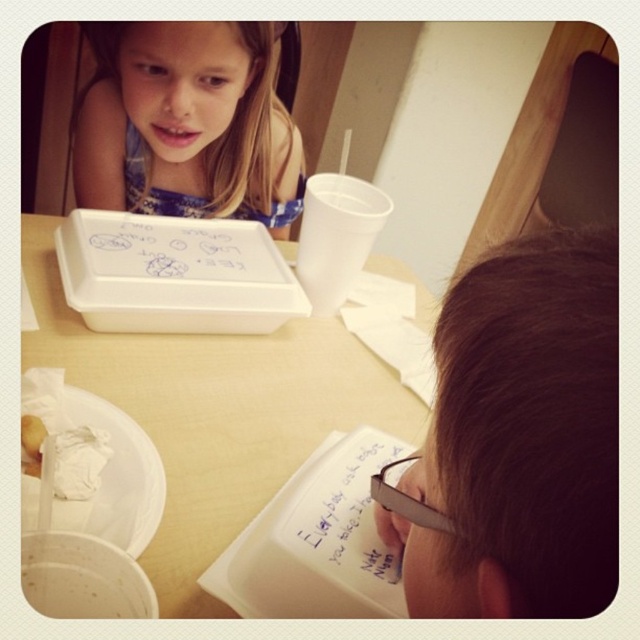
Question: Is white plastic tray at center bigger than white paper at center?

Choices:
 (A) no
 (B) yes

Answer: (B)

Question: Does brown hair at upper right have a larger size compared to white paper at center?

Choices:
 (A) no
 (B) yes

Answer: (B)

Question: Among these points, which one is nearest to the camera?

Choices:
 (A) (385, 547)
 (B) (221, 120)

Answer: (A)

Question: Which point is closer to the camera taking this photo?

Choices:
 (A) (604, 266)
 (B) (29, 349)
 (C) (324, 513)

Answer: (A)

Question: Among these points, which one is nearest to the camera?

Choices:
 (A) (547, 461)
 (B) (336, 460)
 (C) (172, 198)
 (D) (321, 378)

Answer: (A)

Question: Can you confirm if blonde hair at upper left is positioned above white paper at center?

Choices:
 (A) no
 (B) yes

Answer: (B)